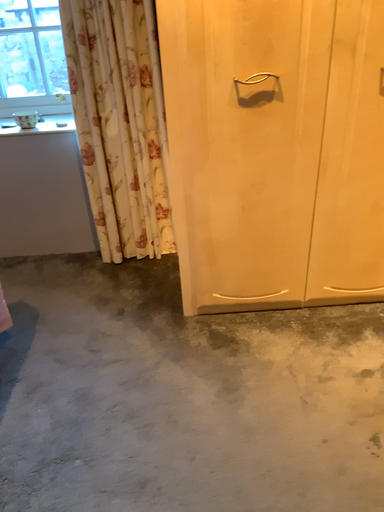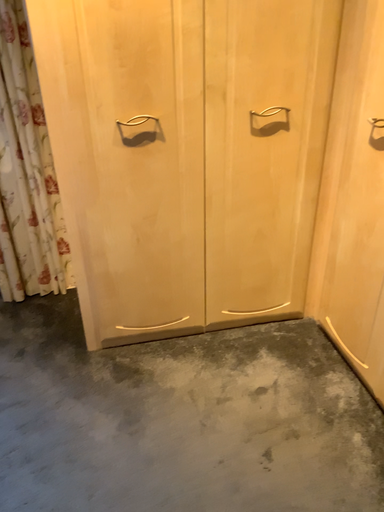
Question: How did the camera likely rotate when shooting the video?

Choices:
 (A) rotated left
 (B) rotated right

Answer: (B)